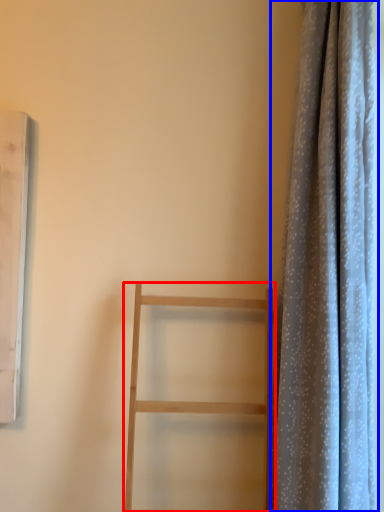
Question: Which object is closer to the camera taking this photo, furniture (highlighted by a red box) or curtain (highlighted by a blue box)?

Choices:
 (A) furniture
 (B) curtain

Answer: (A)